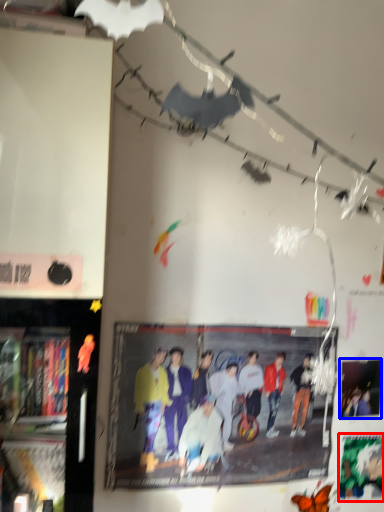
Question: Among these objects, which one is farthest to the camera, poster page (highlighted by a red box) or poster page (highlighted by a blue box)?

Choices:
 (A) poster page
 (B) poster page

Answer: (A)